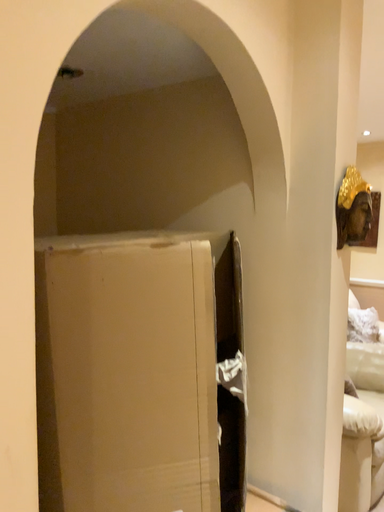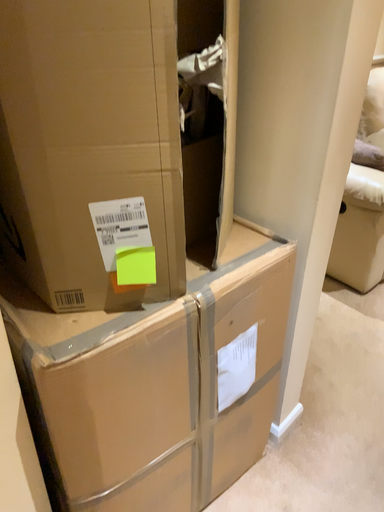
Question: Which way did the camera rotate in the video?

Choices:
 (A) rotated upward
 (B) rotated downward

Answer: (B)